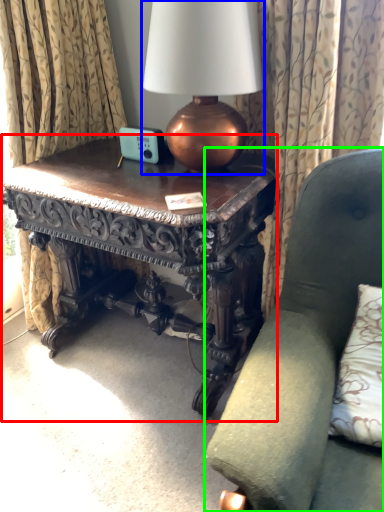
Question: Estimate the real-world distances between objects in this image. Which object is closer to table (highlighted by a red box), lamp (highlighted by a blue box) or chair (highlighted by a green box)?

Choices:
 (A) lamp
 (B) chair

Answer: (A)